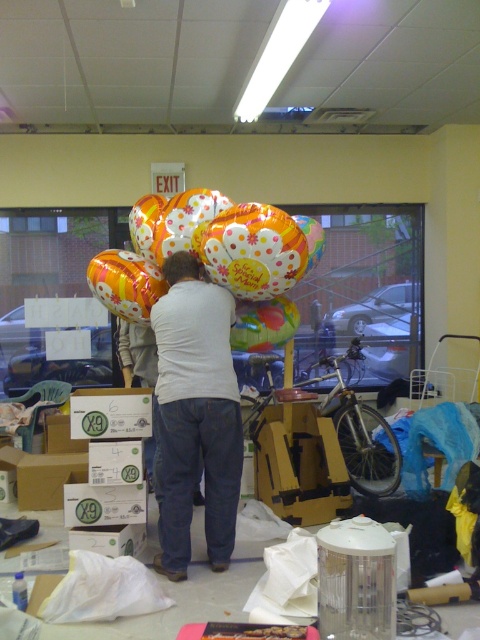
Question: Does metallic gold balloon at upper center have a greater width compared to white cardboard box at lower left?

Choices:
 (A) yes
 (B) no

Answer: (B)

Question: Which point is closer to the camera?

Choices:
 (A) white cardboard box at lower left
 (B) white cotton shirt at center

Answer: (B)

Question: Which object is farther from the camera taking this photo?

Choices:
 (A) white cotton shirt at center
 (B) white cardboard box at lower left
 (C) floral-patterned balloon at center
 (D) metallic gold balloon at upper center

Answer: (B)

Question: Does metallic gold balloon at upper center have a smaller size compared to white cardboard box at lower left?

Choices:
 (A) no
 (B) yes

Answer: (B)

Question: Which point is farther from the camera taking this photo?

Choices:
 (A) (226, 305)
 (B) (23, 493)
 (C) (107, 298)

Answer: (B)

Question: Is the position of white cotton shirt at center more distant than that of white cardboard box at lower left?

Choices:
 (A) yes
 (B) no

Answer: (B)